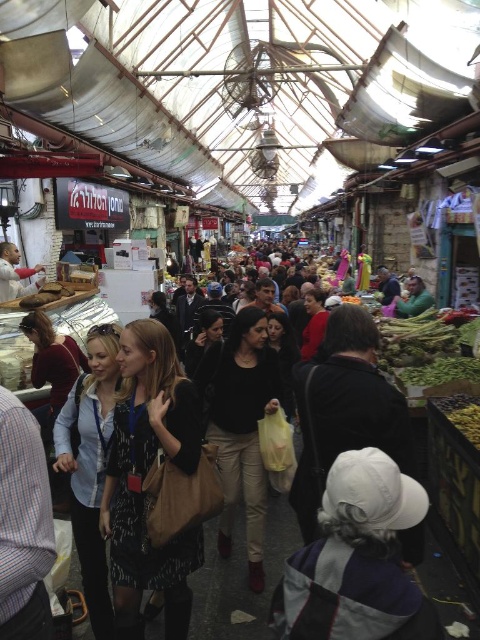
Question: Which point is closer to the camera taking this photo?

Choices:
 (A) (136, 529)
 (B) (305, 627)
 (C) (94, 582)

Answer: (B)

Question: Is white fabric cap at lower center thinner than black matte shirt at center?

Choices:
 (A) no
 (B) yes

Answer: (A)

Question: Can you confirm if patterned fabric dress at center is positioned to the left of matte blue shirt at center?

Choices:
 (A) no
 (B) yes

Answer: (A)

Question: Among these objects, which one is farthest from the camera?

Choices:
 (A) matte blue shirt at center
 (B) patterned fabric dress at center
 (C) black matte shirt at center

Answer: (C)

Question: Does patterned fabric dress at center appear over matte white shirt at center?

Choices:
 (A) yes
 (B) no

Answer: (B)

Question: Which point is farther to the camera?

Choices:
 (A) black matte shirt at center
 (B) matte blue shirt at center
 (C) patterned fabric dress at center
 (D) matte white shirt at center

Answer: (D)